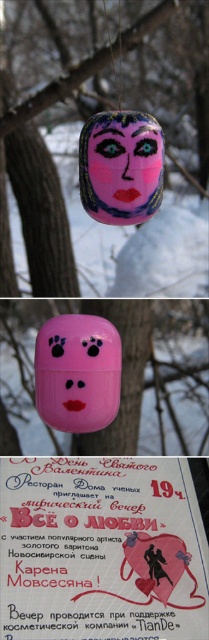
Question: Is slightly glossy wood at upper center to the left of pink matte toy at center from the viewer's perspective?

Choices:
 (A) yes
 (B) no

Answer: (B)

Question: Which point is farther from the camera taking this photo?

Choices:
 (A) (71, 394)
 (B) (188, 561)

Answer: (A)

Question: Which point is closer to the camera?

Choices:
 (A) (53, 413)
 (B) (26, 625)

Answer: (B)

Question: Is the position of slightly glossy wood at upper center less distant than that of pink matte toy at center?

Choices:
 (A) no
 (B) yes

Answer: (A)

Question: Which of the following is the farthest from the observer?

Choices:
 (A) matte pink face at center
 (B) pink matte toy at center
 (C) matte pink poster at center
 (D) slightly glossy wood at upper center

Answer: (D)

Question: Can you confirm if pink matte toy at center is bigger than matte pink face at center?

Choices:
 (A) yes
 (B) no

Answer: (B)